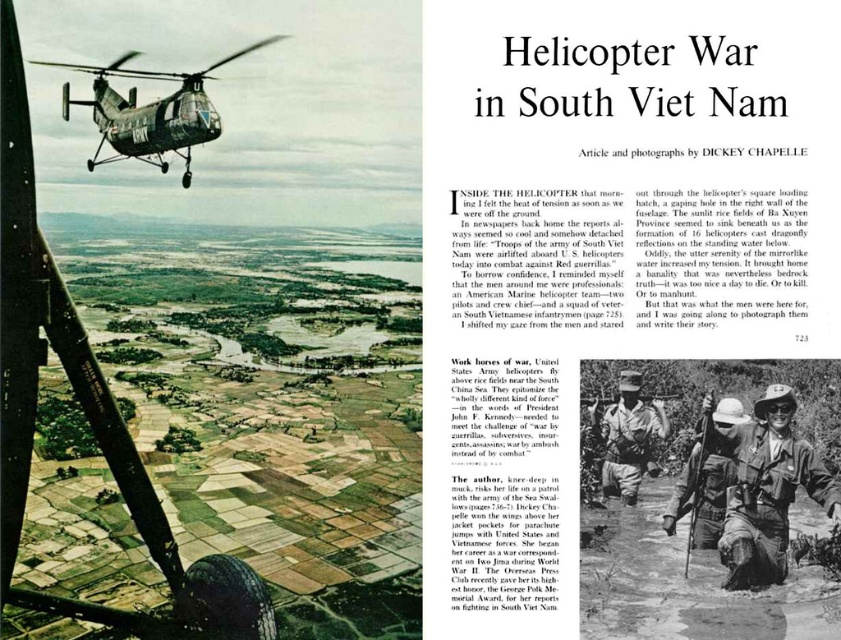
You are a military analyst examining the image of the helicopter crew members. The camouflage fabric helmet at center and the camouflage fabric uniform at center are both visible. Which item is located to the left of the other?

The camouflage fabric helmet at center is positioned on the left side of the camouflage fabric uniform at center.

You are a military analyst reviewing the image. You notice the camouflage fabric helmet at lower right and the green camouflage helicopter at upper left. Based on their positions in the image, which object is closer to the bottom edge of the page?

The camouflage fabric helmet at lower right is closer to the bottom edge of the page because it is positioned below the green camouflage helicopter at upper left.

You are a soldier in the scene. You notice both the camouflage fabric helmet at center and the camouflage fabric uniform at center. Which item is positioned lower on your body?

The camouflage fabric helmet at center is below the camouflage fabric uniform at center, so it is positioned lower on your body.